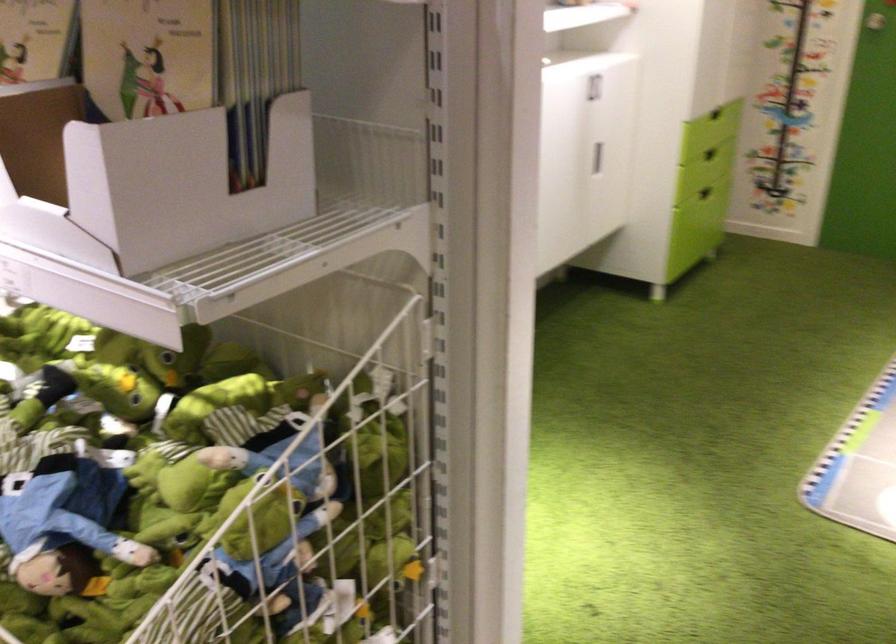
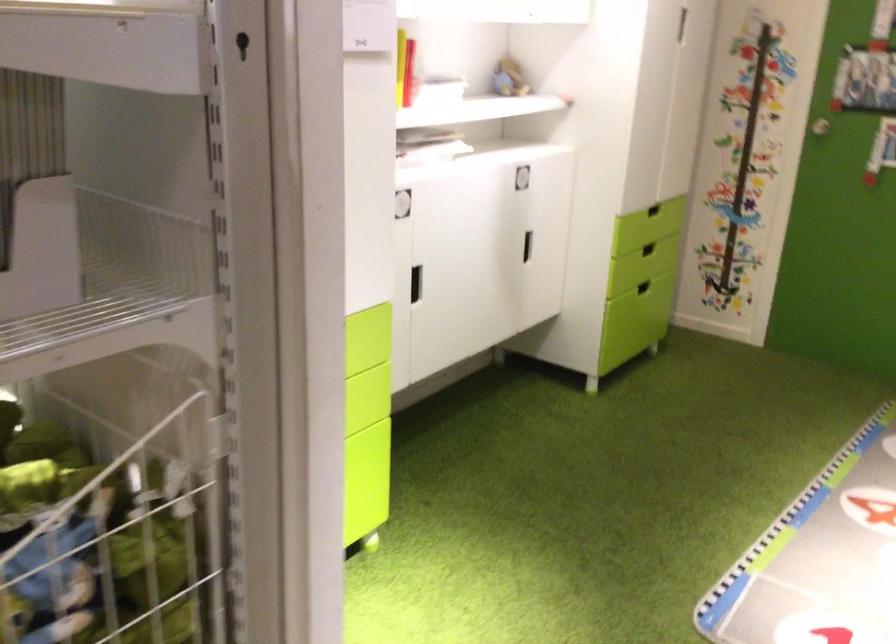
Question: The images are taken continuously from a first-person perspective. In which direction are you moving?

Choices:
 (A) Left
 (B) Right
 (C) Forward
 (D) Backward

Answer: (B)